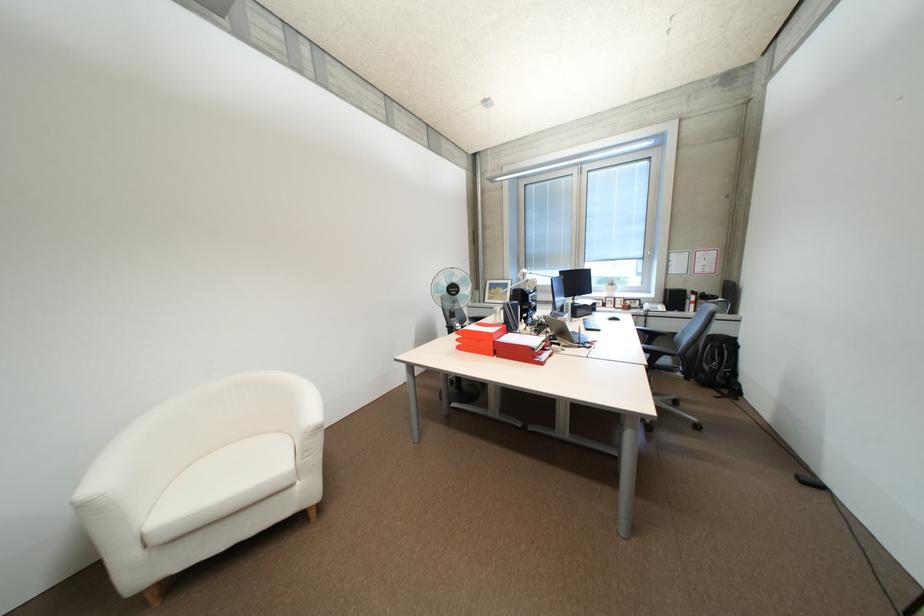
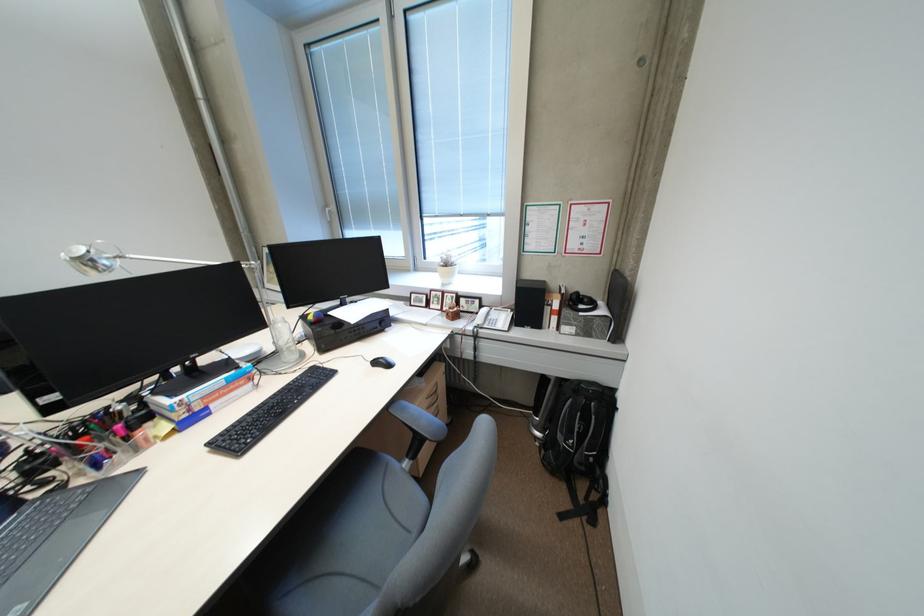
Where in the second image is the point corresponding to the point at 685,299 from the first image?

(538, 302)